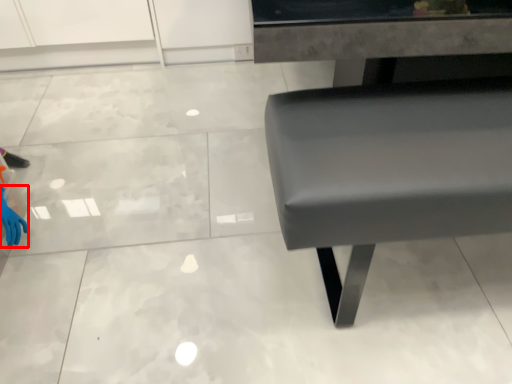
Question: In this image, where is hand (annotated by the red box) located relative to furniture?

Choices:
 (A) left
 (B) right

Answer: (A)